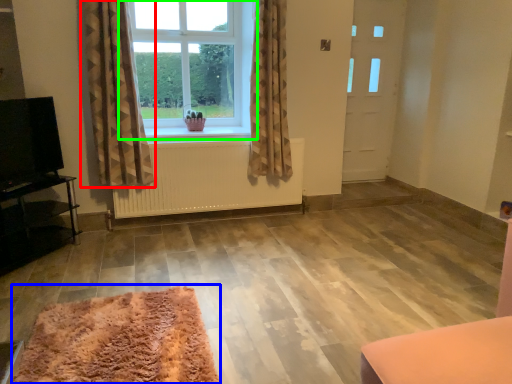
Question: Which object is the closest to the curtain (highlighted by a red box)? Choose among these: mat (highlighted by a blue box) or window (highlighted by a green box).

Choices:
 (A) mat
 (B) window

Answer: (B)